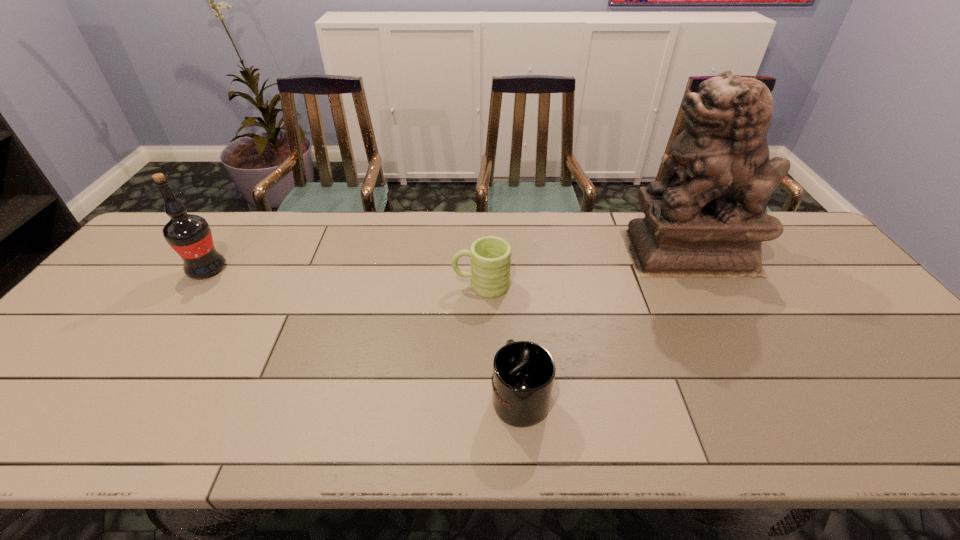
Where is `vacant space at the right edge`? The width and height of the screenshot is (960, 540). vacant space at the right edge is located at coordinates (948, 395).

Identify the location of vacant space that's between the nearest object and the tallest object. (604, 323).

At what (x,y) coordinates should I click in order to perform the action: click on vacant point located between the tallest object and the farther mug. Please return your answer as a coordinate pair (x, y). Looking at the image, I should click on (585, 268).

The image size is (960, 540). I want to click on free point between the wine bottle and the rightmost object, so click(x=447, y=260).

Find the location of a particular element. The width and height of the screenshot is (960, 540). free space between the farther mug and the wine bottle is located at coordinates (345, 277).

Identify the location of empty space that is in between the second tallest object and the rightmost object. The width and height of the screenshot is (960, 540). (447, 260).

The height and width of the screenshot is (540, 960). In order to click on free space between the nearest object and the farther mug in this screenshot , I will do pos(500,340).

The image size is (960, 540). In order to click on free space between the farther mug and the nearer mug in this screenshot , I will do [500, 340].

You are a GUI agent. You are given a task and a screenshot of the screen. Output one action in this format:
    pyautogui.click(x=<x>, y=<y>)
    Task: Click on the free spot between the wine bottle and the sculpture
    Image resolution: width=960 pixels, height=540 pixels.
    Given the screenshot: What is the action you would take?
    pyautogui.click(x=447, y=260)

Identify the location of vacant area that lies between the sculpture and the nearer mug. (604, 323).